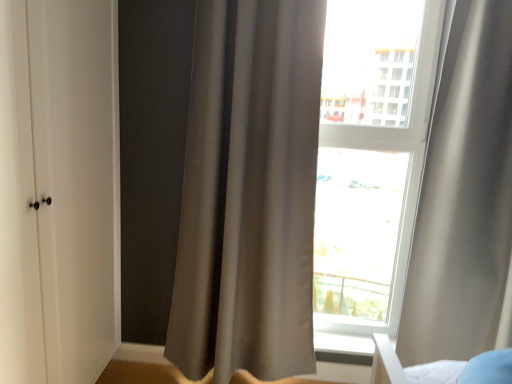
Question: Is white matte cabinet at left bigger than transparent glass window at center?

Choices:
 (A) no
 (B) yes

Answer: (B)

Question: Is the depth of white matte cabinet at left less than that of transparent glass window at center?

Choices:
 (A) yes
 (B) no

Answer: (A)

Question: From a real-world perspective, does white matte cabinet at left sit lower than transparent glass window at center?

Choices:
 (A) yes
 (B) no

Answer: (A)

Question: From a real-world perspective, does white matte cabinet at left stand above transparent glass window at center?

Choices:
 (A) yes
 (B) no

Answer: (B)

Question: From the image's perspective, does white matte cabinet at left appear lower than transparent glass window at center?

Choices:
 (A) yes
 (B) no

Answer: (A)

Question: In the image, is transparent glass window at center on the left side or the right side of satin gray curtain at right, arranged as the second curtain when viewed from the left?

Choices:
 (A) left
 (B) right

Answer: (A)

Question: Do you think transparent glass window at center is within satin gray curtain at right, the first curtain viewed from the right, or outside of it?

Choices:
 (A) inside
 (B) outside

Answer: (B)

Question: Does point (399, 127) appear closer or farther from the camera than point (510, 228)?

Choices:
 (A) farther
 (B) closer

Answer: (A)

Question: Is transparent glass window at center wider or thinner than satin gray curtain at right, the first curtain viewed from the right?

Choices:
 (A) thin
 (B) wide

Answer: (A)

Question: From the image's perspective, is transparent glass window at center positioned above or below white matte cabinet at left?

Choices:
 (A) below
 (B) above

Answer: (B)

Question: In the image, is transparent glass window at center on the left side or the right side of white matte cabinet at left?

Choices:
 (A) left
 (B) right

Answer: (B)

Question: From a real-world perspective, is transparent glass window at center physically located above or below white matte cabinet at left?

Choices:
 (A) above
 (B) below

Answer: (A)

Question: Choose the correct answer: Is transparent glass window at center inside white matte cabinet at left or outside it?

Choices:
 (A) inside
 (B) outside

Answer: (B)

Question: Is white matte cabinet at left taller or shorter than matte gray curtain at center, which is the first curtain from left to right?

Choices:
 (A) short
 (B) tall

Answer: (A)

Question: Is white matte cabinet at left inside or outside of matte gray curtain at center, which ranks as the 2th curtain in right-to-left order?

Choices:
 (A) outside
 (B) inside

Answer: (A)